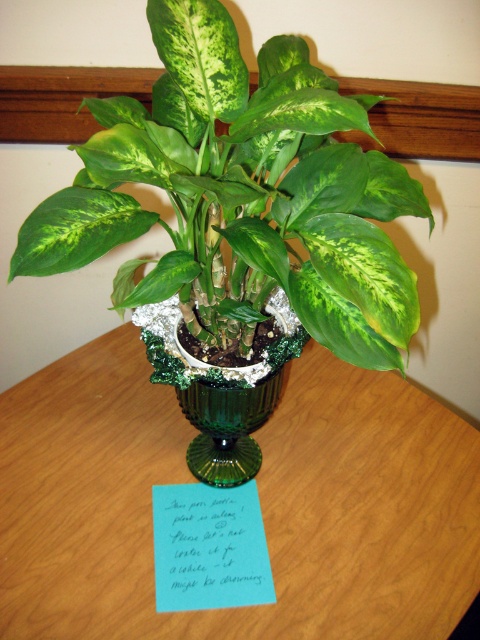
Question: Can you confirm if wooden table at center is positioned below green glossy leafy plant at center?

Choices:
 (A) yes
 (B) no

Answer: (A)

Question: Observing the image, what is the correct spatial positioning of green glossy leafy plant at center in reference to blue paper note at center?

Choices:
 (A) right
 (B) left

Answer: (B)

Question: Based on their relative distances, which object is nearer to the blue paper note at center?

Choices:
 (A) wooden table at center
 (B) green textured vase at center

Answer: (A)

Question: Which point is closer to the camera taking this photo?

Choices:
 (A) (132, 182)
 (B) (242, 432)
 (C) (40, 532)
 (D) (192, 500)

Answer: (A)

Question: Is wooden table at center above blue paper note at center?

Choices:
 (A) no
 (B) yes

Answer: (B)

Question: Based on their relative distances, which object is nearer to the green textured vase at center?

Choices:
 (A) green glossy leafy plant at center
 (B) blue paper note at center
 (C) wooden table at center

Answer: (B)